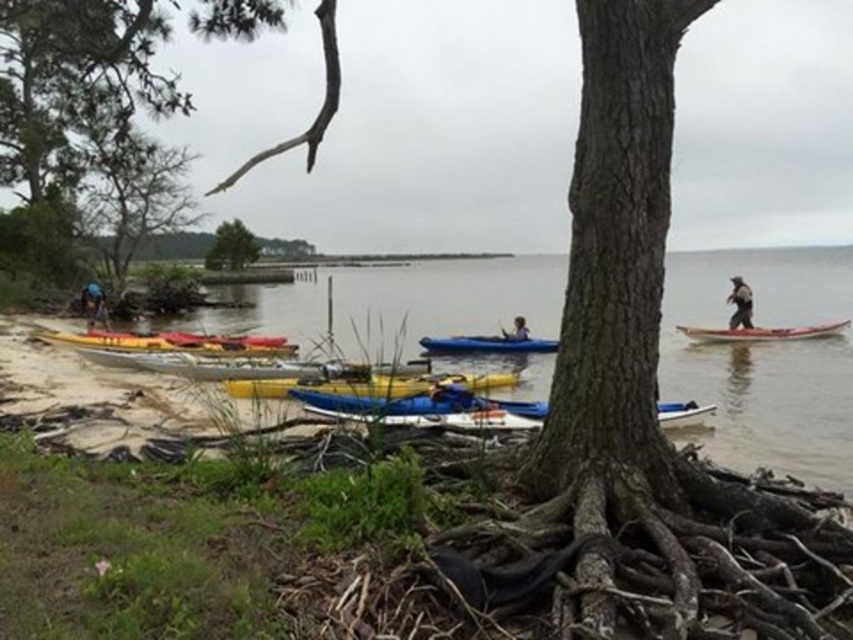
Question: Which point appears farthest from the camera in this image?

Choices:
 (A) (758, 339)
 (B) (16, 38)

Answer: (B)

Question: Can you confirm if green matte tree at upper left is positioned below blue fabric kayak at center?

Choices:
 (A) yes
 (B) no

Answer: (B)

Question: Is blue fabric at lower left to the left of blue fabric kayak at center from the viewer's perspective?

Choices:
 (A) yes
 (B) no

Answer: (A)

Question: Can you confirm if green matte tree at upper left is bigger than blue fabric at lower left?

Choices:
 (A) no
 (B) yes

Answer: (B)

Question: Which of the following is the farthest from the observer?

Choices:
 (A) green leafy tree at center
 (B) smooth pink kayak at right
 (C) blue glossy kayak at center

Answer: (A)

Question: Considering the real-world distances, which object is farthest from the smooth pink kayak at right?

Choices:
 (A) blue glossy kayak at center
 (B) dark gray fabric at right
 (C) green matte tree at upper left
 (D) green leafy tree at center

Answer: (D)